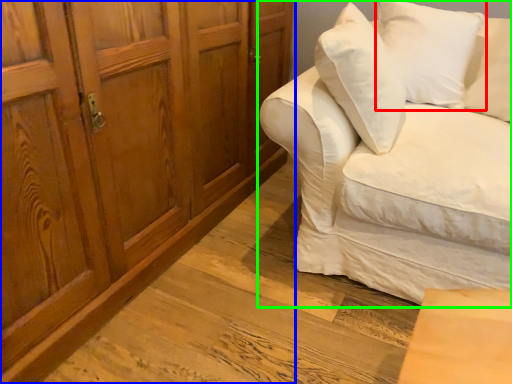
Question: Based on their relative distances, which object is farther from pillow (highlighted by a red box)? Choose from cabinetry (highlighted by a blue box) and studio couch (highlighted by a green box).

Choices:
 (A) cabinetry
 (B) studio couch

Answer: (A)